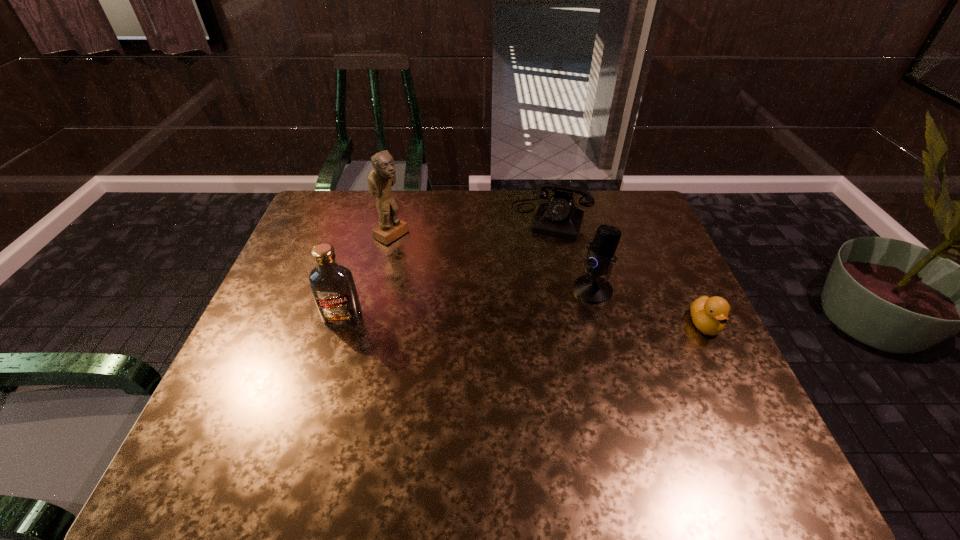
Find the location of a particular element. vacant region located on the front-facing side of the figurine is located at coordinates (416, 248).

Image resolution: width=960 pixels, height=540 pixels. In order to click on vacant space located on the front-facing side of the figurine in this screenshot , I will do `click(488, 286)`.

Find the location of a particular element. Image resolution: width=960 pixels, height=540 pixels. vacant position located 0.130m on the front-facing side of the figurine is located at coordinates (436, 259).

The image size is (960, 540). What are the coordinates of `vacant region located on the stand of the microphone` in the screenshot? It's located at (544, 313).

This screenshot has width=960, height=540. I want to click on vacant region located on the stand of the microphone, so click(x=484, y=341).

Find the location of a particular element. The width and height of the screenshot is (960, 540). free space located on the stand of the microphone is located at coordinates (560, 306).

The image size is (960, 540). I want to click on telephone that is at the far edge, so click(x=559, y=217).

Find the location of a particular element. This screenshot has width=960, height=540. figurine situated at the far edge is located at coordinates (382, 176).

Find the location of a particular element. object situated at the right edge is located at coordinates (709, 315).

Image resolution: width=960 pixels, height=540 pixels. What are the coordinates of `blank space at the far edge of the desktop` in the screenshot? It's located at (461, 212).